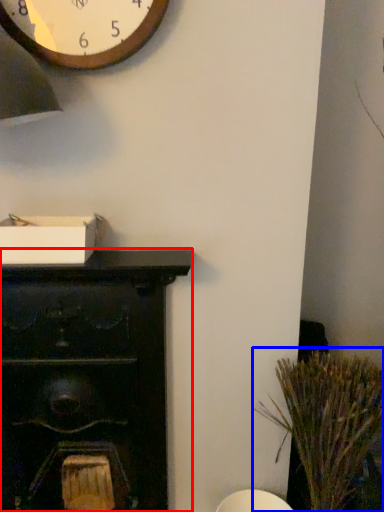
Question: Which point is closer to the camera, furniture (highlighted by a red box) or plant (highlighted by a blue box)?

Choices:
 (A) furniture
 (B) plant

Answer: (B)